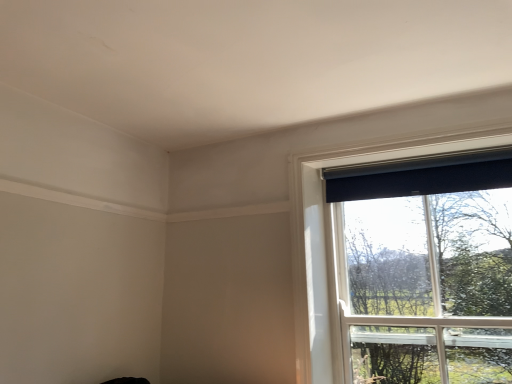
Measure the distance between point (472, 179) and camera.

Point (472, 179) is 6.23 feet from camera.

Find the location of `black matte curtain at upper right`. black matte curtain at upper right is located at coordinates (421, 180).

What do you see at coordinates (421, 180) in the screenshot? I see `black matte curtain at upper right` at bounding box center [421, 180].

Describe the element at coordinates (334, 243) in the screenshot. I see `black matte window at upper right` at that location.

What is the approximate height of black matte window at upper right?

It is 1.09 meters.

Identify the location of black matte window at upper right. The width and height of the screenshot is (512, 384). (334, 243).

The width and height of the screenshot is (512, 384). I want to click on black matte curtain at upper right, so click(421, 180).

Is black matte window at upper right to the left of black matte curtain at upper right from the viewer's perspective?

No.

Which object is further away from the camera taking this photo, black matte window at upper right or black matte curtain at upper right?

black matte curtain at upper right.

Is point (315, 258) positioned in front of point (457, 175)?

No.

From the image's perspective, is black matte window at upper right beneath black matte curtain at upper right?

Indeed, from the image's perspective, black matte window at upper right is shown beneath black matte curtain at upper right.

From a real-world perspective, is black matte window at upper right physically below black matte curtain at upper right?

Yes, from a real-world perspective, black matte window at upper right is under black matte curtain at upper right.

Considering the relative sizes of black matte window at upper right and black matte curtain at upper right in the image provided, is black matte window at upper right wider than black matte curtain at upper right?

Correct, the width of black matte window at upper right exceeds that of black matte curtain at upper right.

Considering the sizes of objects black matte window at upper right and black matte curtain at upper right in the image provided, who is taller, black matte window at upper right or black matte curtain at upper right?

black matte window at upper right.

Between black matte window at upper right and black matte curtain at upper right, which one has larger size?

Bigger between the two is black matte window at upper right.

Would you say black matte window at upper right is inside or outside black matte curtain at upper right?

black matte window at upper right exists outside the volume of black matte curtain at upper right.

Is black matte window at upper right in contact with black matte curtain at upper right?

black matte window at upper right and black matte curtain at upper right are clearly separated.

Is black matte window at upper right turned away from black matte curtain at upper right?

Absolutely, black matte window at upper right is directed away from black matte curtain at upper right.

The width and height of the screenshot is (512, 384). Find the location of `window below the black matte curtain at upper right (from the image's perspective)`. window below the black matte curtain at upper right (from the image's perspective) is located at coordinates (334, 243).

Considering the relative positions of black matte curtain at upper right and black matte window at upper right in the image provided, is black matte curtain at upper right to the left or to the right of black matte window at upper right?

Clearly, black matte curtain at upper right is on the left of black matte window at upper right in the image.

Is black matte curtain at upper right further to the viewer compared to black matte window at upper right?

Yes, it is.

Between point (441, 167) and point (319, 213), which one is positioned in front?

The point (441, 167) is in front.

From the image's perspective, is black matte curtain at upper right above black matte window at upper right?

Yes.

From a real-world perspective, between black matte curtain at upper right and black matte window at upper right, who is vertically lower?

From a 3D spatial view, black matte window at upper right is below.

Which object is wider, black matte curtain at upper right or black matte window at upper right?

With larger width is black matte window at upper right.

In terms of height, does black matte curtain at upper right look taller or shorter compared to black matte window at upper right?

Clearly, black matte curtain at upper right is shorter compared to black matte window at upper right.

Does black matte curtain at upper right have a larger size compared to black matte window at upper right?

Incorrect, black matte curtain at upper right is not larger than black matte window at upper right.

Is black matte window at upper right a part of black matte curtain at upper right?

No, black matte window at upper right is not inside black matte curtain at upper right.

Is black matte curtain at upper right beside black matte window at upper right?

No, black matte curtain at upper right is not touching black matte window at upper right.

Based on the photo, is black matte curtain at upper right oriented towards black matte window at upper right?

No, black matte curtain at upper right is not facing towards black matte window at upper right.

Measure the distance between black matte curtain at upper right and black matte window at upper right.

They are 9.18 inches apart.

Find the location of a particular element. curtain above the black matte window at upper right (from the image's perspective) is located at coordinates (421, 180).

Where is `window below the black matte curtain at upper right (from a real-world perspective)`? This screenshot has width=512, height=384. window below the black matte curtain at upper right (from a real-world perspective) is located at coordinates (334, 243).

This screenshot has width=512, height=384. I want to click on window located in front of the black matte curtain at upper right, so click(334, 243).